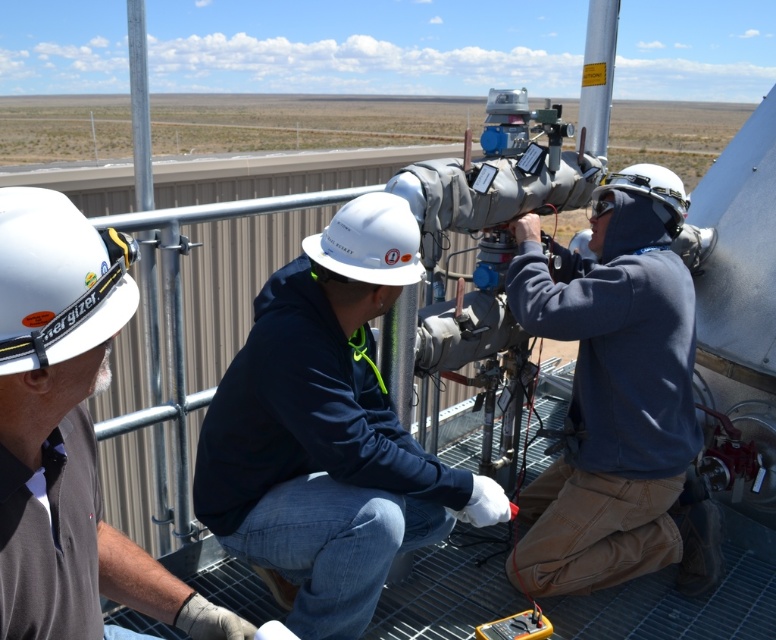
Which is above, blue fleece jacket at center or white hard hat at left?

Positioned higher is white hard hat at left.

Can you confirm if blue fleece jacket at center is bigger than white hard hat at left?

Correct, blue fleece jacket at center is larger in size than white hard hat at left.

Describe the element at coordinates (615, 394) in the screenshot. This screenshot has width=776, height=640. I see `blue fleece jacket at center` at that location.

Find the location of a particular element. Image resolution: width=776 pixels, height=640 pixels. blue fleece jacket at center is located at coordinates (615, 394).

The width and height of the screenshot is (776, 640). Describe the element at coordinates (327, 433) in the screenshot. I see `dark blue hoodie at center` at that location.

Does point (386, 560) come farther from viewer compared to point (35, 406)?

That is True.

This screenshot has width=776, height=640. What do you see at coordinates (327, 433) in the screenshot? I see `dark blue hoodie at center` at bounding box center [327, 433].

Image resolution: width=776 pixels, height=640 pixels. I want to click on dark blue hoodie at center, so click(x=327, y=433).

Does white hard hat at upper left have a smaller size compared to white hard hat at center?

No.

Which is below, white hard hat at upper left or white hard hat at center?

white hard hat at upper left is below.

Between point (120, 547) and point (327, 257), which one is positioned in front?

Point (120, 547) is more forward.

Find the location of a particular element. The width and height of the screenshot is (776, 640). white hard hat at upper left is located at coordinates (68, 433).